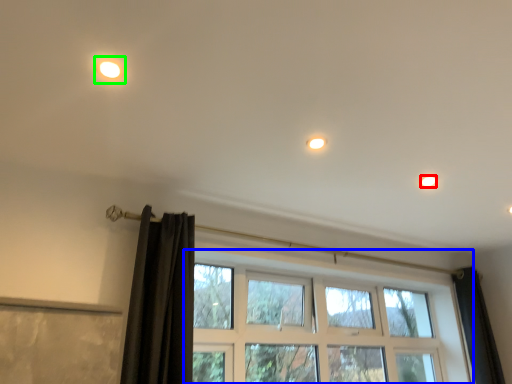
Question: Estimate the real-world distances between objects in this image. Which object is farther from dot (highlighted by a red box), window (highlighted by a blue box) or light (highlighted by a green box)?

Choices:
 (A) window
 (B) light

Answer: (B)